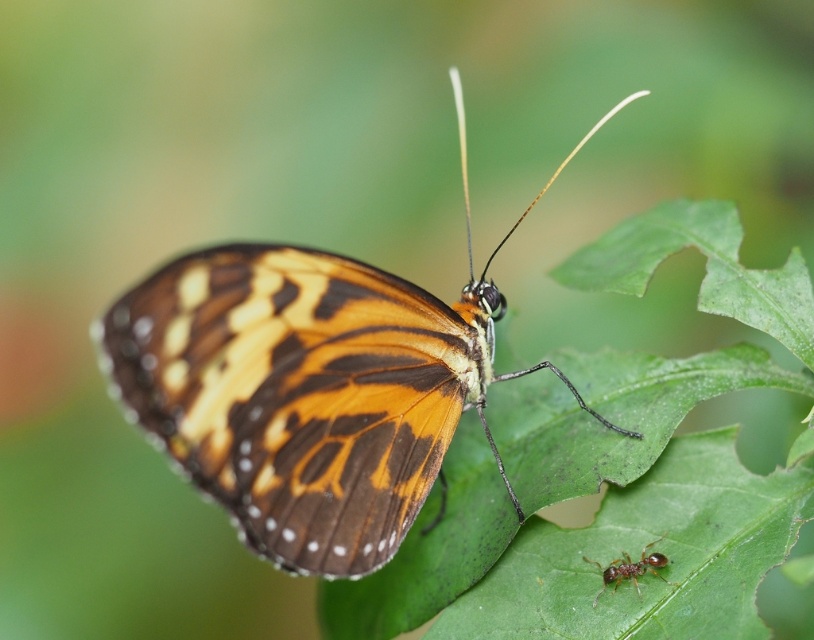
Question: Which point is farther from the camera taking this photo?

Choices:
 (A) (407, 365)
 (B) (650, 556)

Answer: (A)

Question: Which point is farther from the camera taking this photo?

Choices:
 (A) (388, 497)
 (B) (615, 560)

Answer: (A)

Question: Which of the following is the farthest from the observer?

Choices:
 (A) brown shiny ant at lower right
 (B) shiny orange butterfly at center

Answer: (A)

Question: Is shiny orange butterfly at center behind brown shiny ant at lower right?

Choices:
 (A) no
 (B) yes

Answer: (A)

Question: Is shiny orange butterfly at center above brown shiny ant at lower right?

Choices:
 (A) yes
 (B) no

Answer: (A)

Question: Does shiny orange butterfly at center appear on the right side of brown shiny ant at lower right?

Choices:
 (A) yes
 (B) no

Answer: (B)